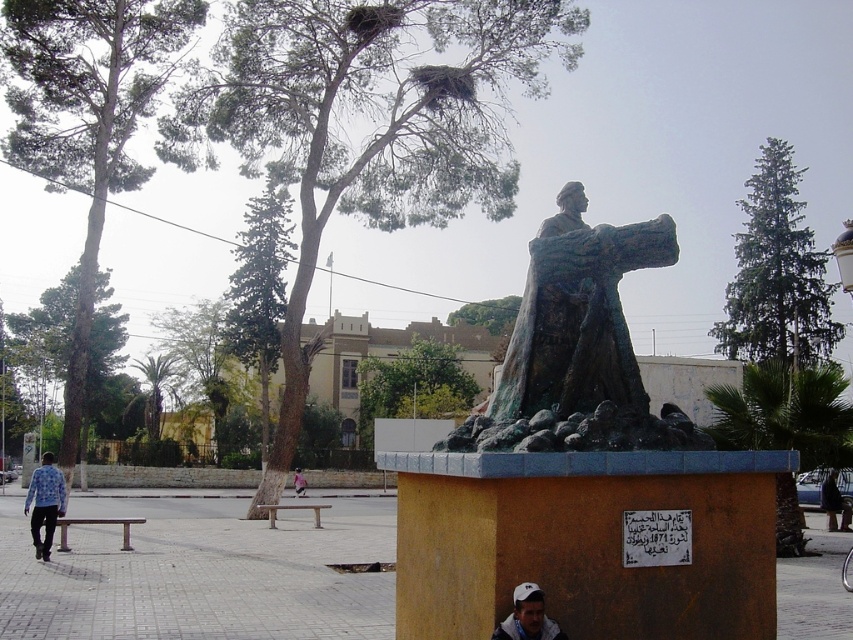
Question: Can you confirm if green patina bronze statue at center is thinner than dark blue jeans at lower right?

Choices:
 (A) no
 (B) yes

Answer: (B)

Question: Which point appears closest to the camera in this image?

Choices:
 (A) (480, 420)
 (B) (846, 508)
 (C) (503, 625)

Answer: (C)

Question: Which of the following is the closest to the observer?

Choices:
 (A) white cap at center
 (B) blue printed shirt at lower left

Answer: (A)

Question: Which point appears closest to the camera in this image?

Choices:
 (A) (833, 483)
 (B) (302, 484)

Answer: (A)

Question: Does green patina bronze statue at center appear over white cap at center?

Choices:
 (A) yes
 (B) no

Answer: (A)

Question: Does blue printed shirt at lower left appear on the right side of white cap at center?

Choices:
 (A) no
 (B) yes

Answer: (A)